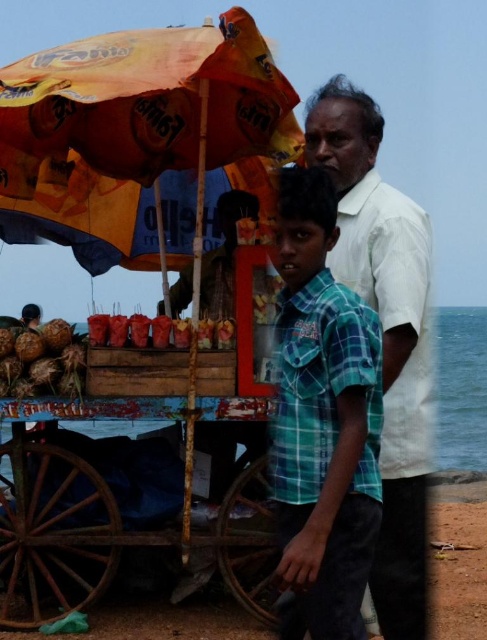
Question: Which point is closer to the camera?

Choices:
 (A) green plaid shirt at center
 (B) shiny red skewers at center

Answer: (A)

Question: Does white cotton shirt at upper center have a lesser width compared to brown rough coconuts at lower left?

Choices:
 (A) no
 (B) yes

Answer: (A)

Question: Can you confirm if green plaid shirt at center is smaller than shiny red skewers at center?

Choices:
 (A) yes
 (B) no

Answer: (B)

Question: Which of the following is the closest to the observer?

Choices:
 (A) (323, 266)
 (B) (21, 387)

Answer: (A)

Question: Does orange printed umbrella at upper left have a smaller size compared to green plaid shirt at center?

Choices:
 (A) yes
 (B) no

Answer: (B)

Question: Which of these objects is positioned farthest from the brown rough coconuts at lower left?

Choices:
 (A) shiny red skewers at center
 (B) white cotton shirt at upper center
 (C) orange printed umbrella at upper left

Answer: (B)